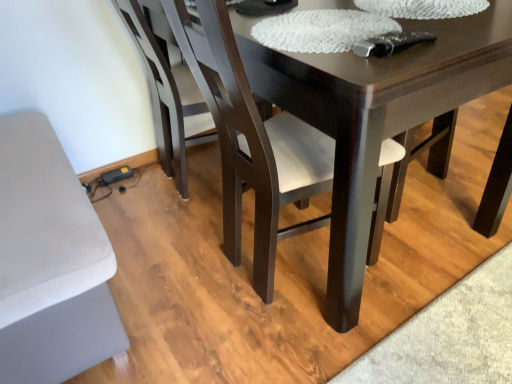
This screenshot has width=512, height=384. Find the location of `free space in front of dark wood chair at lower left, which ranks as the first chair in back-to-front order`. free space in front of dark wood chair at lower left, which ranks as the first chair in back-to-front order is located at coordinates (161, 238).